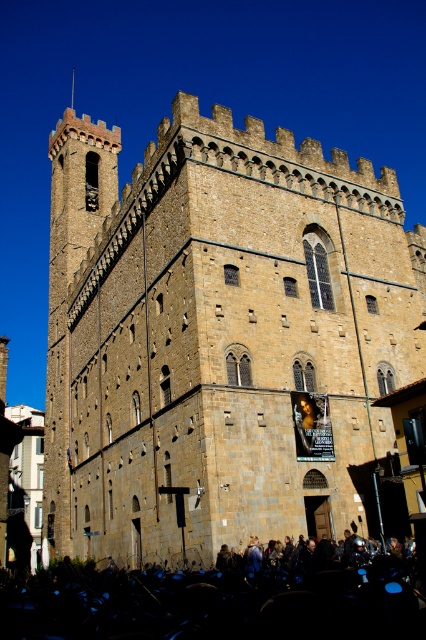
Can you confirm if brown stone castle at center is wider than black matte crowd at lower center?

Indeed, brown stone castle at center has a greater width compared to black matte crowd at lower center.

Looking at this image, is brown stone castle at center taller than black matte crowd at lower center?

Yes.

Does point (86, 493) come farther from viewer compared to point (210, 612)?

Yes, point (86, 493) is farther from viewer.

The width and height of the screenshot is (426, 640). In order to click on brown stone castle at center in this screenshot , I will do `click(218, 333)`.